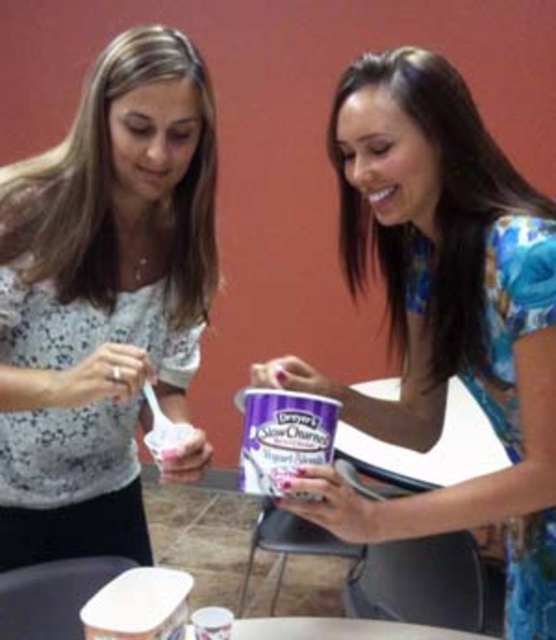
You are a photographer setting up a shoot in this dining area. You need to position a spotlight so that it illuminates both the white lace blouse at left and the floral dress at center without casting shadows over the table. Based on their positions, where should you place the spotlight relative to these two items?

The white lace blouse at left is to the left of the floral dress at center. To avoid casting shadows over the table, the spotlight should be placed to the right of the floral dress at center so that light falls evenly on both items from that direction.

Based on the coordinates provided, which object corresponds to the point at [103,298]?

The white lace blouse at left corresponds to the point at [103,298].